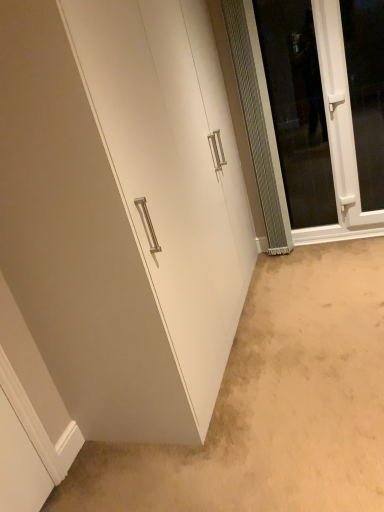
You are a GUI agent. You are given a task and a screenshot of the screen. Output one action in this format:
    pyautogui.click(x=<x>, y=<y>)
    Task: Click on the white matte cabinet at center
    Image resolution: width=384 pixels, height=512 pixels.
    Given the screenshot: What is the action you would take?
    pyautogui.click(x=172, y=170)

Where is `clear glass screen door at right`? The width and height of the screenshot is (384, 512). clear glass screen door at right is located at coordinates (x=297, y=109).

Locate an element on the screen. This screenshot has height=512, width=384. white plastic window at upper right is located at coordinates (366, 93).

Looking at this image, is white matte cabinet at lower left in front of or behind white matte cabinet at center in the image?

In the image, white matte cabinet at lower left appears behind white matte cabinet at center.

Measure the distance between white matte cabinet at lower left and white matte cabinet at center.

A distance of 28.30 inches exists between white matte cabinet at lower left and white matte cabinet at center.

Which of these two, white matte cabinet at lower left or white matte cabinet at center, stands shorter?

Standing shorter between the two is white matte cabinet at lower left.

Which of these two, white matte cabinet at lower left or white matte cabinet at center, is thinner?

white matte cabinet at center is thinner.

Considering the relative positions of white matte cabinet at lower left and white plastic window at upper right in the image provided, is white matte cabinet at lower left to the left of white plastic window at upper right from the viewer's perspective?

Correct, you'll find white matte cabinet at lower left to the left of white plastic window at upper right.

Can we say white matte cabinet at lower left lies outside white plastic window at upper right?

Yes, white matte cabinet at lower left is not within white plastic window at upper right.

From the image's perspective, is white matte cabinet at lower left located beneath white plastic window at upper right?

Yes, from the image's perspective, white matte cabinet at lower left is beneath white plastic window at upper right.

Does white matte cabinet at center have a larger size compared to clear glass screen door at right?

Yes, white matte cabinet at center is bigger than clear glass screen door at right.

Between white matte cabinet at center and clear glass screen door at right, which one is positioned in front?

Positioned in front is white matte cabinet at center.

In terms of width, does white matte cabinet at center look wider or thinner when compared to clear glass screen door at right?

white matte cabinet at center is wider than clear glass screen door at right.

Is clear glass screen door at right in front of or behind white plastic window at upper right in the image?

clear glass screen door at right is behind white plastic window at upper right.

From a real-world perspective, who is located higher, clear glass screen door at right or white plastic window at upper right?

clear glass screen door at right.

Could you tell me if clear glass screen door at right is turned towards white plastic window at upper right?

No, clear glass screen door at right is not facing towards white plastic window at upper right.

From the image's perspective, would you say clear glass screen door at right is positioned over white plastic window at upper right?

Yes.

Do you think white matte cabinet at center is within white plastic window at upper right, or outside of it?

white matte cabinet at center is not enclosed by white plastic window at upper right.

Considering the relative sizes of white matte cabinet at center and white plastic window at upper right in the image provided, is white matte cabinet at center bigger than white plastic window at upper right?

Indeed, white matte cabinet at center has a larger size compared to white plastic window at upper right.

Is white matte cabinet at center turned away from white plastic window at upper right?

No.

From the image's perspective, is white matte cabinet at center beneath white plastic window at upper right?

Indeed, from the image's perspective, white matte cabinet at center is shown beneath white plastic window at upper right.

Which is behind, point (363, 86) or point (207, 144)?

The point (363, 86) is farther from the camera.

Does white plastic window at upper right appear on the right side of white matte cabinet at center?

Correct, you'll find white plastic window at upper right to the right of white matte cabinet at center.

Is white plastic window at upper right positioned with its back to white matte cabinet at center?

No, white plastic window at upper right is not facing away from white matte cabinet at center.

Which of these two, white plastic window at upper right or white matte cabinet at center, is bigger?

Bigger between the two is white matte cabinet at center.

Is clear glass screen door at right bigger than white matte cabinet at lower left?

Actually, clear glass screen door at right might be smaller than white matte cabinet at lower left.

Looking at their sizes, would you say clear glass screen door at right is wider or thinner than white matte cabinet at lower left?

clear glass screen door at right is thinner than white matte cabinet at lower left.

In the image, there is a clear glass screen door at right. Where is `plain below it (from the image's perspective)`? Image resolution: width=384 pixels, height=512 pixels. plain below it (from the image's perspective) is located at coordinates (273, 403).

Considering the points (313, 224) and (318, 319), which point is in front, point (313, 224) or point (318, 319)?

Positioned in front is point (318, 319).

Find the location of a particular element. The image size is (384, 512). door on the left of white matte cabinet at lower left is located at coordinates (172, 170).

The height and width of the screenshot is (512, 384). In order to click on window behind the white matte cabinet at lower left in this screenshot , I will do `click(366, 93)`.

When comparing their distances from white matte cabinet at lower left, does white plastic window at upper right or white matte cabinet at center seem closer?

Based on the image, white matte cabinet at center appears to be nearer to white matte cabinet at lower left.

Estimate the real-world distances between objects in this image. Which object is closer to white matte cabinet at center, white matte cabinet at lower left or clear glass screen door at right?

white matte cabinet at lower left lies closer to white matte cabinet at center than the other object.

From the image, which object appears to be nearer to white plastic window at upper right, white matte cabinet at center or clear glass screen door at right?

clear glass screen door at right lies closer to white plastic window at upper right than the other object.

When comparing their distances from white matte cabinet at lower left, does white plastic window at upper right or clear glass screen door at right seem further?

white plastic window at upper right is positioned further to the anchor white matte cabinet at lower left.

Looking at the image, which one is located closer to clear glass screen door at right, white plastic window at upper right or white matte cabinet at center?

Based on the image, white plastic window at upper right appears to be nearer to clear glass screen door at right.

Considering their positions, is clear glass screen door at right positioned further to white matte cabinet at center than white plastic window at upper right?

Based on the image, white plastic window at upper right appears to be further to white matte cabinet at center.

When comparing their distances from white matte cabinet at center, does white matte cabinet at lower left or white plastic window at upper right seem closer?

Among the two, white matte cabinet at lower left is located nearer to white matte cabinet at center.

Estimate the real-world distances between objects in this image. Which object is further from clear glass screen door at right, white plastic window at upper right or white matte cabinet at lower left?

white matte cabinet at lower left lies further to clear glass screen door at right than the other object.

Find the location of a particular element. window located between white matte cabinet at lower left and clear glass screen door at right in the depth direction is located at coordinates (366, 93).

Identify the location of plain positioned between white matte cabinet at center and white plastic window at upper right from near to far. This screenshot has height=512, width=384. (273, 403).

I want to click on window between white matte cabinet at center and clear glass screen door at right from front to back, so click(x=366, y=93).

At what (x,y) coordinates should I click in order to perform the action: click on plain between white matte cabinet at center and clear glass screen door at right along the z-axis. Please return your answer as a coordinate pair (x, y). Looking at the image, I should click on (273, 403).